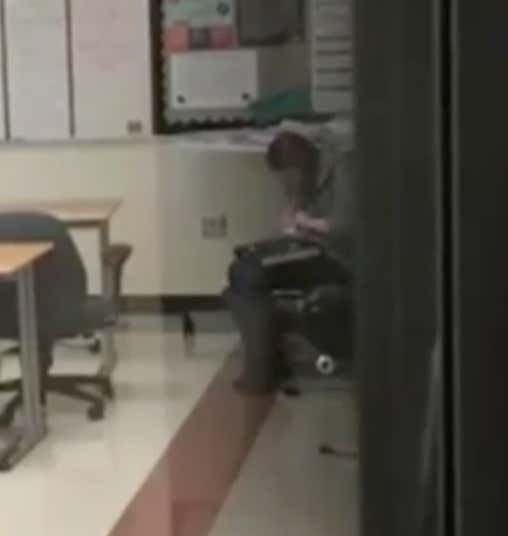
This screenshot has height=536, width=508. I want to click on chair, so click(58, 281).